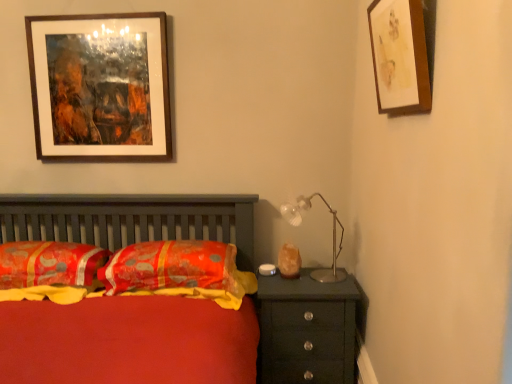
The image size is (512, 384). Identify the location of silky orange pillow at center, the 1th pillow in the left-to-right sequence. (49, 263).

What is the approximate width of metallic silver table lamp at upper right?

The width of metallic silver table lamp at upper right is 13.46 inches.

What do you see at coordinates (178, 271) in the screenshot?
I see `orange printed fabric pillow at center, which is counted as the 2th pillow, starting from the left` at bounding box center [178, 271].

You are a GUI agent. You are given a task and a screenshot of the screen. Output one action in this format:
    pyautogui.click(x=<x>, y=<y>)
    Task: Click on the wooden picture frame at upper left, the 2th picture frame in the front-to-back sequence
    The image size is (512, 384).
    Given the screenshot: What is the action you would take?
    pyautogui.click(x=100, y=87)

Locate an element on the screen. This screenshot has height=384, width=512. silky orange pillow at center, which appears as the 2th pillow when viewed from the right is located at coordinates (49, 263).

Based on the photo, from the image's perspective, is matte black chest of drawers at right below silky orange pillow at center, which appears as the 2th pillow when viewed from the right?

Yes.

Is matte black chest of drawers at right beside silky orange pillow at center, the 1th pillow in the left-to-right sequence?

matte black chest of drawers at right is not next to silky orange pillow at center, the 1th pillow in the left-to-right sequence, and they're not touching.

How much distance is there between matte black chest of drawers at right and silky orange pillow at center, which appears as the 2th pillow when viewed from the right?

matte black chest of drawers at right is 3.53 feet away from silky orange pillow at center, which appears as the 2th pillow when viewed from the right.

Considering the relative sizes of matte black chest of drawers at right and silky orange pillow at center, the 1th pillow in the left-to-right sequence, in the image provided, is matte black chest of drawers at right smaller than silky orange pillow at center, the 1th pillow in the left-to-right sequence,?

Actually, matte black chest of drawers at right might be larger than silky orange pillow at center, the 1th pillow in the left-to-right sequence.

From a real-world perspective, between wooden picture frame at upper right, which is counted as the first picture frame, starting from the front, and silky orange pillow at center, which appears as the 2th pillow when viewed from the right, who is vertically lower?

In real-world perspective, silky orange pillow at center, which appears as the 2th pillow when viewed from the right, is lower.

Is wooden picture frame at upper right, positioned as the first picture frame in right-to-left order, wider than silky orange pillow at center, which appears as the 2th pillow when viewed from the right?

In fact, wooden picture frame at upper right, positioned as the first picture frame in right-to-left order, might be narrower than silky orange pillow at center, which appears as the 2th pillow when viewed from the right.

How distant is wooden picture frame at upper right, the 2th picture frame when ordered from left to right, from silky orange pillow at center, which appears as the 2th pillow when viewed from the right?

They are 5.64 feet apart.

Find the location of a particular element. the 1st pillow behind the wooden picture frame at upper right, which ranks as the 2th picture frame in back-to-front order is located at coordinates (49, 263).

From a real-world perspective, does orange printed fabric pillow at center, which is counted as the 2th pillow, starting from the left, stand above matte black chest of drawers at right?

Yes, from a real-world perspective, orange printed fabric pillow at center, which is counted as the 2th pillow, starting from the left, is on top of matte black chest of drawers at right.

How distant is orange printed fabric pillow at center, which is counted as the 2th pillow, starting from the left, from matte black chest of drawers at right?

A distance of 16.21 inches exists between orange printed fabric pillow at center, which is counted as the 2th pillow, starting from the left, and matte black chest of drawers at right.

In the image, is orange printed fabric pillow at center, which is counted as the 2th pillow, starting from the left, on the left side or the right side of matte black chest of drawers at right?

In the image, orange printed fabric pillow at center, which is counted as the 2th pillow, starting from the left, appears on the left side of matte black chest of drawers at right.

Find the location of a particular element. Image resolution: width=512 pixels, height=384 pixels. the 1st pillow above the matte black chest of drawers at right (from the image's perspective) is located at coordinates (178, 271).

Based on the photo, does matte black chest of drawers at right contain metallic silver table lamp at upper right?

No, metallic silver table lamp at upper right is located outside of matte black chest of drawers at right.

Considering the positions of points (348, 279) and (341, 280), is point (348, 279) closer to camera compared to point (341, 280)?

No, (348, 279) is further to viewer.

In the image, there is a matte black chest of drawers at right. Where is `table lamp above it (from the image's perspective)`? table lamp above it (from the image's perspective) is located at coordinates (333, 234).

Considering the relative positions of matte black chest of drawers at right and metallic silver table lamp at upper right in the image provided, is matte black chest of drawers at right to the left of metallic silver table lamp at upper right from the viewer's perspective?

Yes.

Which object is wider, metallic silver table lamp at upper right or silky orange pillow at center, the 1th pillow in the left-to-right sequence?

With larger width is silky orange pillow at center, the 1th pillow in the left-to-right sequence.

Which object is more forward, metallic silver table lamp at upper right or silky orange pillow at center, which appears as the 2th pillow when viewed from the right?

silky orange pillow at center, which appears as the 2th pillow when viewed from the right, is more forward.

Considering the sizes of metallic silver table lamp at upper right and silky orange pillow at center, the 1th pillow in the left-to-right sequence, in the image, is metallic silver table lamp at upper right taller or shorter than silky orange pillow at center, the 1th pillow in the left-to-right sequence,?

In the image, metallic silver table lamp at upper right appears to be taller than silky orange pillow at center, the 1th pillow in the left-to-right sequence.

From the picture: Considering their positions, is silky orange pillow at center, the 1th pillow in the left-to-right sequence, located in front of or behind wooden picture frame at upper left, the 2th picture frame in the right-to-left sequence?

Visually, silky orange pillow at center, the 1th pillow in the left-to-right sequence, is located in front of wooden picture frame at upper left, the 2th picture frame in the right-to-left sequence.

Based on the photo, is silky orange pillow at center, the 1th pillow in the left-to-right sequence, beside wooden picture frame at upper left, which is the first picture frame from left to right?

No, silky orange pillow at center, the 1th pillow in the left-to-right sequence, is not in contact with wooden picture frame at upper left, which is the first picture frame from left to right.

Which is nearer, (70, 274) or (151, 30)?

Point (70, 274) is closer to the camera than point (151, 30).

Based on their sizes in the image, would you say silky orange pillow at center, the 1th pillow in the left-to-right sequence, is bigger or smaller than wooden picture frame at upper left, which is the first picture frame from left to right?

Considering their sizes, silky orange pillow at center, the 1th pillow in the left-to-right sequence, takes up more space than wooden picture frame at upper left, which is the first picture frame from left to right.

Is wooden picture frame at upper left, which is the first picture frame from left to right, positioned before silky orange pillow at center, the 1th pillow in the left-to-right sequence?

No, it is not.

Does wooden picture frame at upper left, which is the first picture frame from left to right, turn towards silky orange pillow at center, the 1th pillow in the left-to-right sequence?

No, wooden picture frame at upper left, which is the first picture frame from left to right, is not aimed at silky orange pillow at center, the 1th pillow in the left-to-right sequence.

How different are the orientations of wooden picture frame at upper left, which appears as the 1th picture frame when viewed from the back, and silky orange pillow at center, the 1th pillow in the left-to-right sequence, in degrees?

The facing directions of wooden picture frame at upper left, which appears as the 1th picture frame when viewed from the back, and silky orange pillow at center, the 1th pillow in the left-to-right sequence, are 0.000379 degrees apart.

Which of these two, wooden picture frame at upper left, the 2th picture frame in the front-to-back sequence, or silky orange pillow at center, the 1th pillow in the left-to-right sequence, stands shorter?

Standing shorter between the two is silky orange pillow at center, the 1th pillow in the left-to-right sequence.

Locate an element on the screen. This screenshot has width=512, height=384. chest of drawers behind the silky orange pillow at center, the 1th pillow in the left-to-right sequence is located at coordinates (306, 330).

From the image's perspective, count 1st pillows downward from the wooden picture frame at upper right, the 2th picture frame when ordered from left to right, and point to it. Please provide its 2D coordinates.

[(49, 263)]

Which object lies nearer to the anchor point metallic silver table lamp at upper right, matte black chest of drawers at right or orange printed fabric pillow at center, which is counted as the 2th pillow, starting from the left?

The object closer to metallic silver table lamp at upper right is matte black chest of drawers at right.

Based on their spatial positions, is wooden picture frame at upper right, which ranks as the 2th picture frame in back-to-front order, or wooden picture frame at upper left, the 2th picture frame in the front-to-back sequence, further from orange printed fabric pillow at center, which is counted as the 2th pillow, starting from the left?

The object further to orange printed fabric pillow at center, which is counted as the 2th pillow, starting from the left, is wooden picture frame at upper right, which ranks as the 2th picture frame in back-to-front order.

Considering their positions, is wooden picture frame at upper right, positioned as the first picture frame in right-to-left order, positioned closer to matte black chest of drawers at right than silky orange pillow at center, the 1th pillow in the left-to-right sequence?

silky orange pillow at center, the 1th pillow in the left-to-right sequence, is closer to matte black chest of drawers at right.

Based on the photo, looking at the image, which one is located closer to orange printed fabric pillow at center, which ranks as the first pillow in right-to-left order, metallic silver table lamp at upper right or wooden picture frame at upper left, the 2th picture frame in the right-to-left sequence?

metallic silver table lamp at upper right lies closer to orange printed fabric pillow at center, which ranks as the first pillow in right-to-left order, than the other object.

Based on their spatial positions, is orange printed fabric pillow at center, which ranks as the first pillow in right-to-left order, or wooden picture frame at upper right, which is counted as the first picture frame, starting from the front, further from metallic silver table lamp at upper right?

wooden picture frame at upper right, which is counted as the first picture frame, starting from the front, is positioned further to the anchor metallic silver table lamp at upper right.

When comparing their distances from metallic silver table lamp at upper right, does wooden picture frame at upper left, which is the first picture frame from left to right, or silky orange pillow at center, the 1th pillow in the left-to-right sequence, seem closer?

silky orange pillow at center, the 1th pillow in the left-to-right sequence, lies closer to metallic silver table lamp at upper right than the other object.

Based on their spatial positions, is wooden picture frame at upper left, the 2th picture frame in the right-to-left sequence, or orange printed fabric pillow at center, which is counted as the 2th pillow, starting from the left, closer to wooden picture frame at upper right, the 2th picture frame when ordered from left to right?

The object closer to wooden picture frame at upper right, the 2th picture frame when ordered from left to right, is orange printed fabric pillow at center, which is counted as the 2th pillow, starting from the left.

Estimate the real-world distances between objects in this image. Which object is closer to wooden picture frame at upper left, which is the first picture frame from left to right, wooden picture frame at upper right, the 2th picture frame when ordered from left to right, or metallic silver table lamp at upper right?

Based on the image, metallic silver table lamp at upper right appears to be nearer to wooden picture frame at upper left, which is the first picture frame from left to right.

At what (x,y) coordinates should I click in order to perform the action: click on pillow located between silky orange pillow at center, which appears as the 2th pillow when viewed from the right, and wooden picture frame at upper right, which is counted as the first picture frame, starting from the front, in the left-right direction. Please return your answer as a coordinate pair (x, y). Looking at the image, I should click on (178, 271).

Image resolution: width=512 pixels, height=384 pixels. In order to click on pillow between wooden picture frame at upper left, the 2th picture frame in the right-to-left sequence, and wooden picture frame at upper right, which ranks as the 2th picture frame in back-to-front order in this screenshot , I will do `click(178, 271)`.

Locate an element on the screen. This screenshot has width=512, height=384. chest of drawers between silky orange pillow at center, which appears as the 2th pillow when viewed from the right, and wooden picture frame at upper right, the 2th picture frame when ordered from left to right, from left to right is located at coordinates (306, 330).

Identify the location of picture frame between silky orange pillow at center, which appears as the 2th pillow when viewed from the right, and wooden picture frame at upper right, which ranks as the 2th picture frame in back-to-front order, from left to right. The width and height of the screenshot is (512, 384). (100, 87).